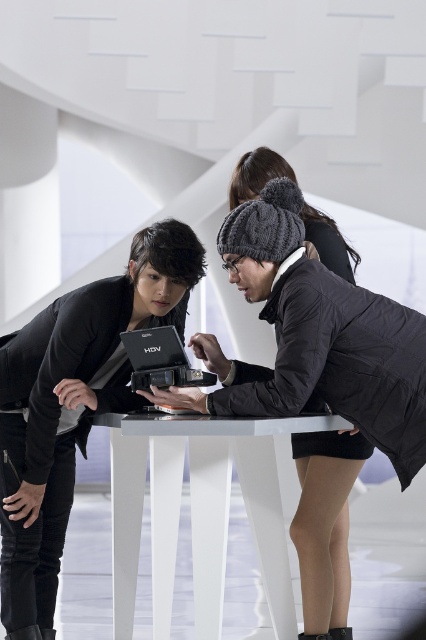
From the picture: Who is more forward, (164, 529) or (189, 365)?

Point (189, 365) is in front.

Does white glossy table at center have a greater height compared to black matte laptop at center?

Yes.

Where is `white glossy table at center`? white glossy table at center is located at coordinates (198, 509).

Does black matte laptop at left lie in front of black matte laptop at center?

Yes, black matte laptop at left is closer to the viewer.

Which is more to the left, black matte laptop at left or black matte laptop at center?

black matte laptop at left is more to the left.

Is point (40, 369) behind point (167, 330)?

No, (40, 369) is in front of (167, 330).

Find the location of a particular element. The image size is (426, 640). black matte laptop at left is located at coordinates (72, 406).

Is black matte laptop at left above white glossy table at center?

Correct, black matte laptop at left is located above white glossy table at center.

Between black matte laptop at left and white glossy table at center, which one is positioned lower?

white glossy table at center is lower down.

Image resolution: width=426 pixels, height=640 pixels. I want to click on black matte laptop at left, so click(72, 406).

I want to click on black matte laptop at left, so click(72, 406).